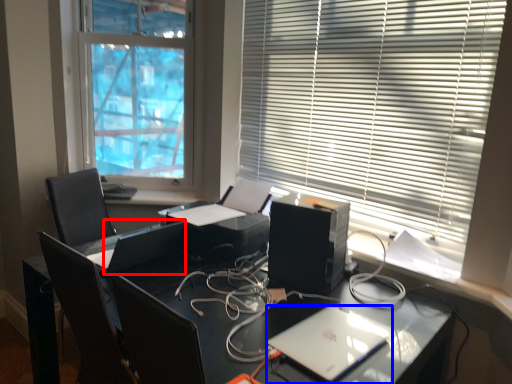
Question: Which object appears farthest to the camera in this image, computer monitor (highlighted by a red box) or laptop (highlighted by a blue box)?

Choices:
 (A) computer monitor
 (B) laptop

Answer: (A)